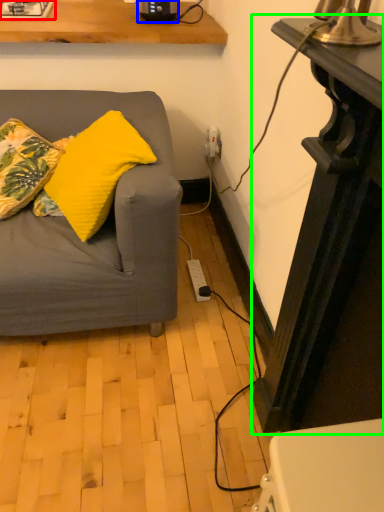
Question: Which object is positioned farthest from gas stove (highlighted by a red box)? Select from appliance (highlighted by a blue box) and table (highlighted by a green box).

Choices:
 (A) appliance
 (B) table

Answer: (B)